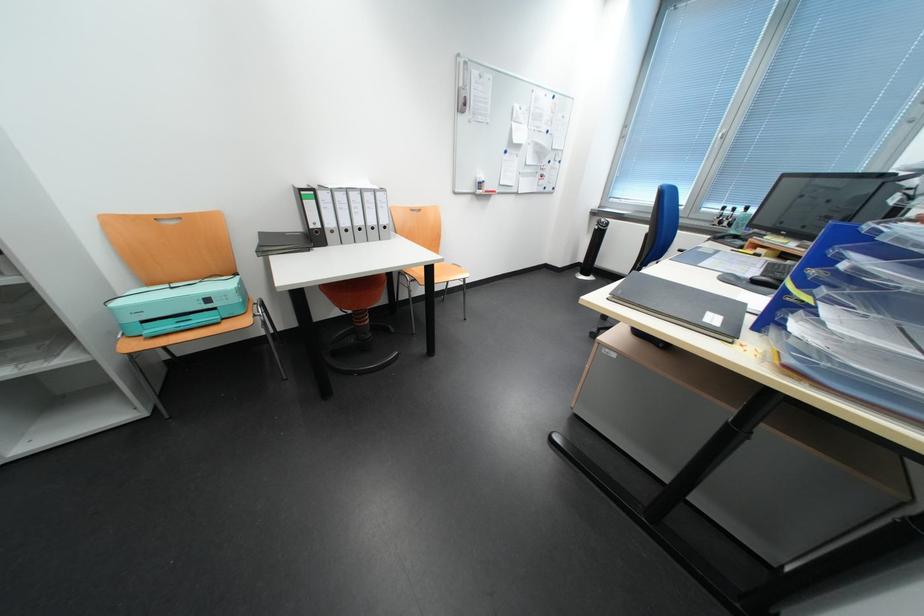
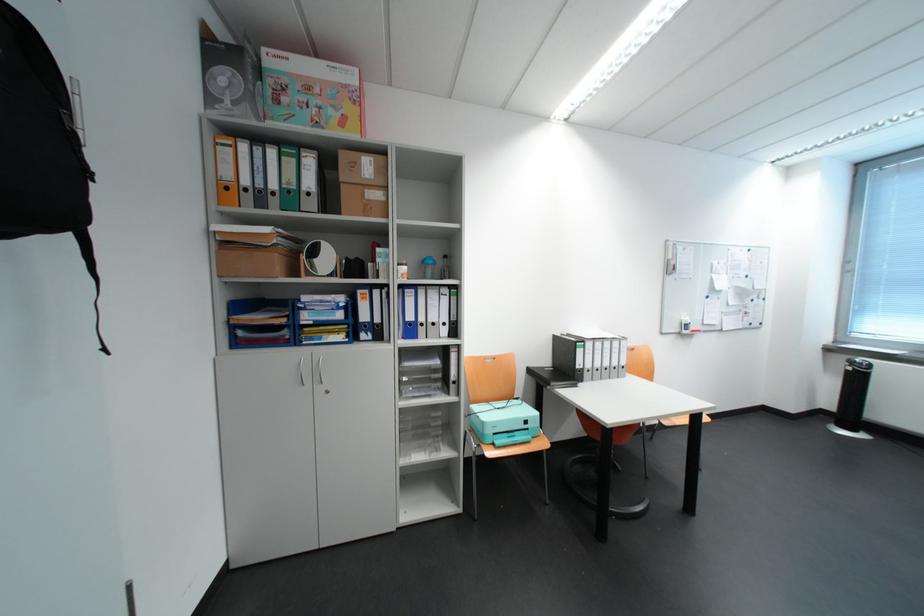
Where in the second image is the point corresponding to pixel 367 197 from the first image?

(618, 345)